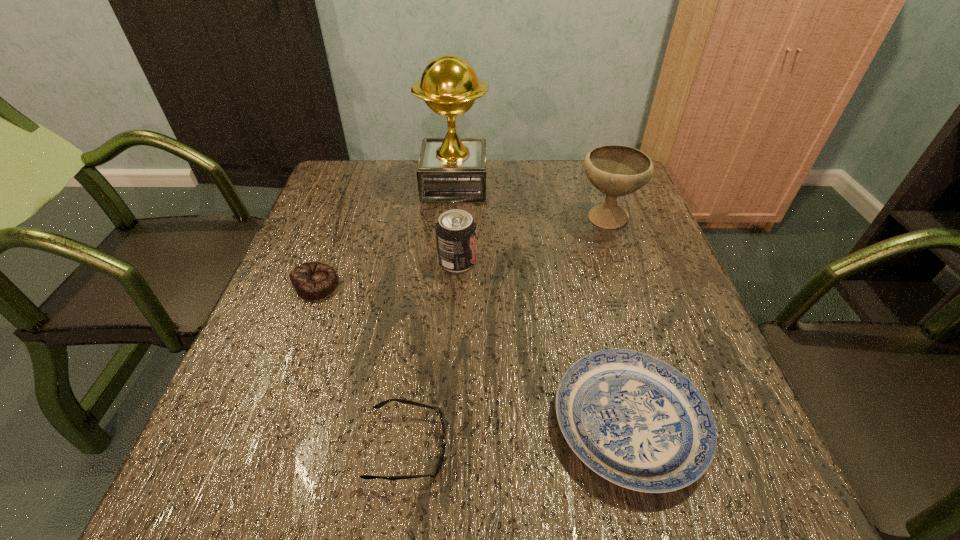
The width and height of the screenshot is (960, 540). Identify the location of the tallest object. (451, 169).

This screenshot has width=960, height=540. I want to click on chalice, so click(616, 170).

Where is `the third tallest object`? the third tallest object is located at coordinates (456, 233).

The height and width of the screenshot is (540, 960). I want to click on the leftmost object, so click(312, 280).

You are a GUI agent. You are given a task and a screenshot of the screen. Output one action in this format:
    pyautogui.click(x=<x>, y=<y>)
    Task: Click on the sunglasses
    
    Given the screenshot: What is the action you would take?
    pyautogui.click(x=433, y=474)

You are a GUI agent. You are given a task and a screenshot of the screen. Output one action in this format:
    pyautogui.click(x=<x>, y=<y>)
    Task: Click on the plate
    
    Given the screenshot: What is the action you would take?
    pyautogui.click(x=635, y=420)

This screenshot has height=540, width=960. Identify the location of free location located on the front-facing side of the tallest object. (542, 184).

You are a GUI agent. You are given a task and a screenshot of the screen. Output one action in this format:
    pyautogui.click(x=<x>, y=<y>)
    Task: Click on the vacant space located 0.140m on the back of the chalice
    The height and width of the screenshot is (540, 960).
    Given the screenshot: What is the action you would take?
    pyautogui.click(x=591, y=175)

Locate an element on the screen. Image resolution: width=960 pixels, height=540 pixels. vacant area situated on the right of the fourth shortest object is located at coordinates (616, 261).

I want to click on free space located on the front of the leftmost object, so pyautogui.click(x=301, y=326).